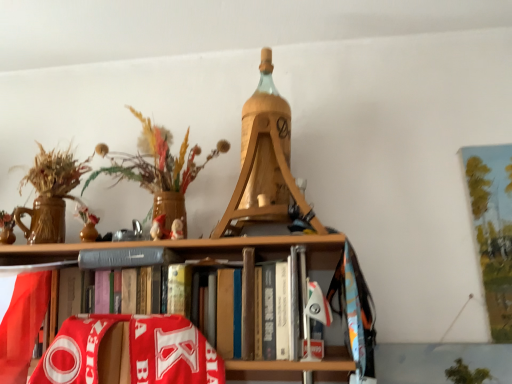
Question: From the image's perspective, would you say gray matte book at center is positioned over wooden vase with dried flowers at upper left?

Choices:
 (A) yes
 (B) no

Answer: (B)

Question: Can we say gray matte book at center lies outside wooden vase with dried flowers at upper left?

Choices:
 (A) no
 (B) yes

Answer: (B)

Question: Is gray matte book at center positioned far away from wooden vase with dried flowers at upper left?

Choices:
 (A) no
 (B) yes

Answer: (A)

Question: Can you confirm if gray matte book at center is shorter than wooden vase with dried flowers at upper left?

Choices:
 (A) yes
 (B) no

Answer: (A)

Question: Does gray matte book at center come behind wooden vase with dried flowers at upper left?

Choices:
 (A) yes
 (B) no

Answer: (A)

Question: Which is correct: hardcover book at center is inside gray matte book at center, or outside of it?

Choices:
 (A) outside
 (B) inside

Answer: (A)

Question: In terms of size, does hardcover book at center appear bigger or smaller than gray matte book at center?

Choices:
 (A) small
 (B) big

Answer: (B)

Question: From a real-world perspective, relative to gray matte book at center, is hardcover book at center vertically above or below?

Choices:
 (A) below
 (B) above

Answer: (A)

Question: In terms of height, does hardcover book at center look taller or shorter compared to gray matte book at center?

Choices:
 (A) tall
 (B) short

Answer: (A)

Question: From a real-world perspective, is wooden vase with dried flowers at upper left positioned above or below gray matte book at center?

Choices:
 (A) below
 (B) above

Answer: (B)

Question: Relative to gray matte book at center, is wooden vase with dried flowers at upper left in front or behind?

Choices:
 (A) behind
 (B) front

Answer: (B)

Question: Is wooden vase with dried flowers at upper left bigger or smaller than gray matte book at center?

Choices:
 (A) big
 (B) small

Answer: (A)

Question: In the image, is wooden vase with dried flowers at upper left on the left side or the right side of gray matte book at center?

Choices:
 (A) right
 (B) left

Answer: (A)

Question: Is hardcover book at center in front of or behind wooden vase with dried flowers at upper left in the image?

Choices:
 (A) behind
 (B) front

Answer: (B)

Question: In terms of height, does hardcover book at center look taller or shorter compared to wooden vase with dried flowers at upper left?

Choices:
 (A) short
 (B) tall

Answer: (A)